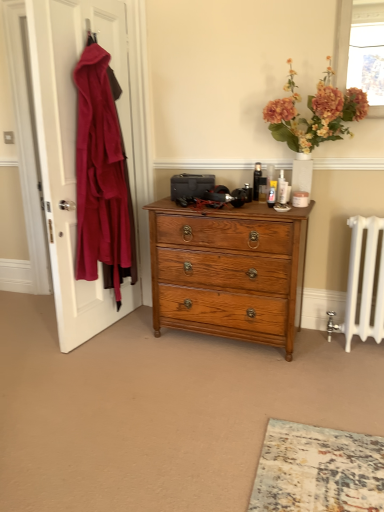
Question: Is matte orange flowers at upper right positioned with its back to translucent glass window screen at upper right?

Choices:
 (A) no
 (B) yes

Answer: (A)

Question: Is matte orange flowers at upper right oriented towards translucent glass window screen at upper right?

Choices:
 (A) no
 (B) yes

Answer: (A)

Question: From a real-world perspective, is matte orange flowers at upper right on translucent glass window screen at upper right?

Choices:
 (A) no
 (B) yes

Answer: (A)

Question: Is matte orange flowers at upper right shorter than translucent glass window screen at upper right?

Choices:
 (A) no
 (B) yes

Answer: (A)

Question: Considering the relative sizes of matte orange flowers at upper right and translucent glass window screen at upper right in the image provided, is matte orange flowers at upper right taller than translucent glass window screen at upper right?

Choices:
 (A) no
 (B) yes

Answer: (B)

Question: From a real-world perspective, is velvet red coat at left above or below shiny oak chest of drawers at center?

Choices:
 (A) below
 (B) above

Answer: (B)

Question: From the image's perspective, relative to shiny oak chest of drawers at center, is velvet red coat at left above or below?

Choices:
 (A) above
 (B) below

Answer: (A)

Question: From their relative heights in the image, would you say velvet red coat at left is taller or shorter than shiny oak chest of drawers at center?

Choices:
 (A) tall
 (B) short

Answer: (A)

Question: Based on their sizes in the image, would you say velvet red coat at left is bigger or smaller than shiny oak chest of drawers at center?

Choices:
 (A) small
 (B) big

Answer: (A)

Question: Is velvet red coat at left spatially inside matte orange flowers at upper right, or outside of it?

Choices:
 (A) outside
 (B) inside

Answer: (A)

Question: From the image's perspective, is velvet red coat at left above or below matte orange flowers at upper right?

Choices:
 (A) above
 (B) below

Answer: (B)

Question: Looking at the image, does velvet red coat at left seem bigger or smaller compared to matte orange flowers at upper right?

Choices:
 (A) small
 (B) big

Answer: (B)

Question: From a real-world perspective, is velvet red coat at left physically located above or below matte orange flowers at upper right?

Choices:
 (A) above
 (B) below

Answer: (B)

Question: In the image, is matte orange flowers at upper right positioned in front of or behind translucent glass window screen at upper right?

Choices:
 (A) behind
 (B) front

Answer: (B)

Question: Would you say matte orange flowers at upper right is inside or outside translucent glass window screen at upper right?

Choices:
 (A) inside
 (B) outside

Answer: (B)